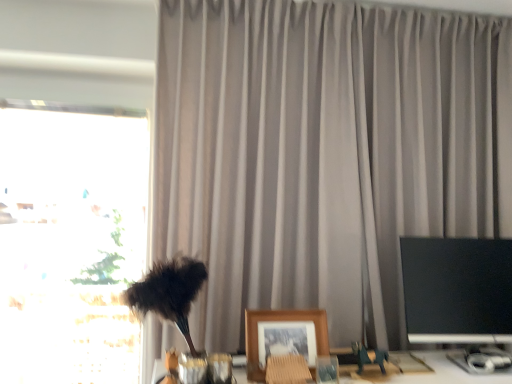
Question: Is transparent glass window at left taller than matte gray curtain at center?

Choices:
 (A) no
 (B) yes

Answer: (A)

Question: Considering the relative sizes of transparent glass window at left and matte gray curtain at center in the image provided, is transparent glass window at left bigger than matte gray curtain at center?

Choices:
 (A) no
 (B) yes

Answer: (A)

Question: Does transparent glass window at left appear on the right side of matte gray curtain at center?

Choices:
 (A) yes
 (B) no

Answer: (B)

Question: Is transparent glass window at left at the left side of matte gray curtain at center?

Choices:
 (A) no
 (B) yes

Answer: (B)

Question: Is transparent glass window at left smaller than matte gray curtain at center?

Choices:
 (A) no
 (B) yes

Answer: (B)

Question: Is transparent glass window at left not close to matte gray curtain at center?

Choices:
 (A) no
 (B) yes

Answer: (A)

Question: From a real-world perspective, is metallic green toy horse at lower right located beneath wooden framed photo at center?

Choices:
 (A) yes
 (B) no

Answer: (A)

Question: Is metallic green toy horse at lower right oriented towards wooden framed photo at center?

Choices:
 (A) no
 (B) yes

Answer: (A)

Question: From the image's perspective, is metallic green toy horse at lower right on top of wooden framed photo at center?

Choices:
 (A) yes
 (B) no

Answer: (B)

Question: Considering the relative positions of metallic green toy horse at lower right and wooden framed photo at center in the image provided, is metallic green toy horse at lower right in front of wooden framed photo at center?

Choices:
 (A) yes
 (B) no

Answer: (B)

Question: Is metallic green toy horse at lower right bigger than wooden framed photo at center?

Choices:
 (A) no
 (B) yes

Answer: (A)

Question: From the image's perspective, is metallic green toy horse at lower right located beneath wooden framed photo at center?

Choices:
 (A) no
 (B) yes

Answer: (B)

Question: Considering the relative sizes of metallic green toy horse at lower right and black glossy monitor at right in the image provided, is metallic green toy horse at lower right smaller than black glossy monitor at right?

Choices:
 (A) no
 (B) yes

Answer: (B)